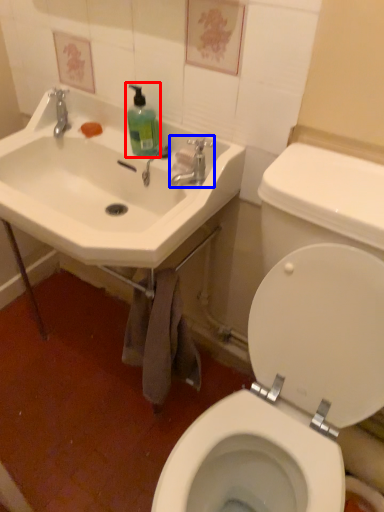
Question: Among these objects, which one is nearest to the camera, cleaning product (highlighted by a red box) or tap (highlighted by a blue box)?

Choices:
 (A) cleaning product
 (B) tap

Answer: (B)